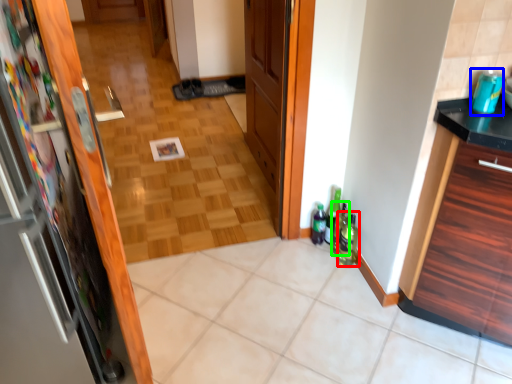
Question: Considering the real-world distances, which object is closest to beverage (highlighted by a red box)? beverage (highlighted by a blue box) or bottle (highlighted by a green box).

Choices:
 (A) beverage
 (B) bottle

Answer: (B)